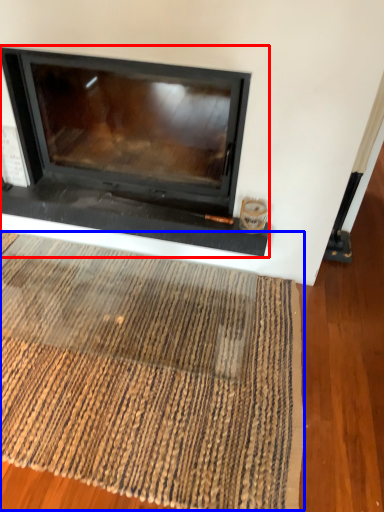
Question: Which object is closer to the camera taking this photo, fireplace (highlighted by a red box) or mat (highlighted by a blue box)?

Choices:
 (A) fireplace
 (B) mat

Answer: (B)